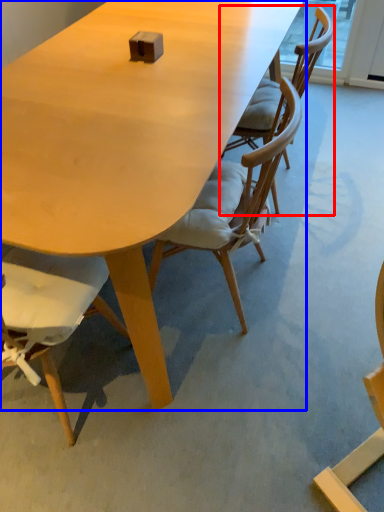
Question: Which object appears farthest to the camera in this image, chair (highlighted by a red box) or table (highlighted by a blue box)?

Choices:
 (A) chair
 (B) table

Answer: (A)